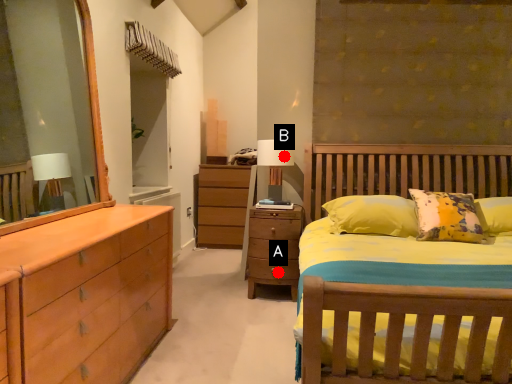
Question: Two points are circled on the image, labeled by A and B beside each circle. Which point is closer to the camera taking this photo?

Choices:
 (A) A is closer
 (B) B is closer

Answer: (A)